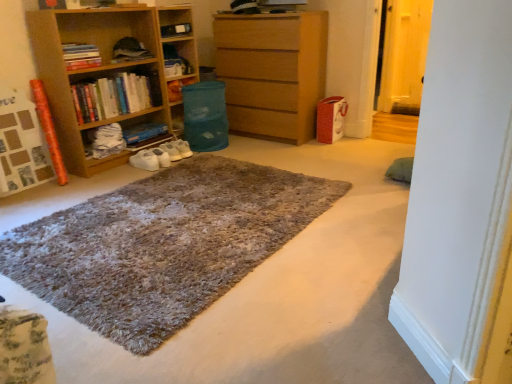
Question: Considering the relative sizes of hardcover books at left, which is the second book in bottom-to-top order, and wooden chest of drawers at center in the image provided, is hardcover books at left, which is the second book in bottom-to-top order, smaller than wooden chest of drawers at center?

Choices:
 (A) yes
 (B) no

Answer: (A)

Question: Does hardcover books at left, which is the second book in bottom-to-top order, lie behind wooden chest of drawers at center?

Choices:
 (A) yes
 (B) no

Answer: (B)

Question: From a real-world perspective, is hardcover books at left, the second book viewed from the top, positioned over wooden chest of drawers at center based on gravity?

Choices:
 (A) no
 (B) yes

Answer: (B)

Question: Is hardcover books at left, which is the second book in bottom-to-top order, shorter than wooden chest of drawers at center?

Choices:
 (A) yes
 (B) no

Answer: (A)

Question: From the image's perspective, does hardcover books at left, which is the second book in bottom-to-top order, appear lower than wooden chest of drawers at center?

Choices:
 (A) no
 (B) yes

Answer: (B)

Question: From the image's perspective, does hardcover books at left, which is the second book in bottom-to-top order, appear higher than wooden chest of drawers at center?

Choices:
 (A) yes
 (B) no

Answer: (B)

Question: Is wooden bookshelf at left, marked as the second shelf in a right-to-left arrangement, completely or partially inside shaggy carpet at center?

Choices:
 (A) no
 (B) yes

Answer: (A)

Question: Considering the relative positions of shaggy carpet at center and wooden bookshelf at left, marked as the second shelf in a right-to-left arrangement, in the image provided, is shaggy carpet at center to the right of wooden bookshelf at left, marked as the second shelf in a right-to-left arrangement, from the viewer's perspective?

Choices:
 (A) yes
 (B) no

Answer: (A)

Question: Is shaggy carpet at center at the left side of wooden bookshelf at left, marked as the second shelf in a right-to-left arrangement?

Choices:
 (A) yes
 (B) no

Answer: (B)

Question: Can you confirm if shaggy carpet at center is thinner than wooden bookshelf at left, marked as the second shelf in a right-to-left arrangement?

Choices:
 (A) no
 (B) yes

Answer: (A)

Question: Is shaggy carpet at center beside wooden bookshelf at left, marked as the second shelf in a right-to-left arrangement?

Choices:
 (A) no
 (B) yes

Answer: (A)

Question: Is shaggy carpet at center behind wooden bookshelf at left, marked as the second shelf in a right-to-left arrangement?

Choices:
 (A) yes
 (B) no

Answer: (B)

Question: Is the surface of hardcover books at left, which is the second book in bottom-to-top order, in direct contact with hardcover books at left, which is counted as the 3th book, starting from the bottom?

Choices:
 (A) no
 (B) yes

Answer: (A)